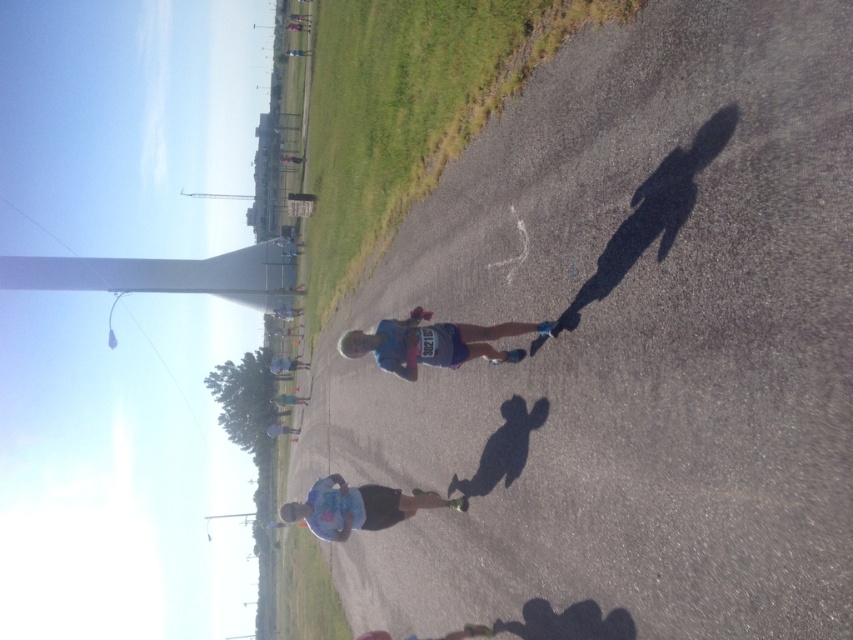
You are a photographer standing at the starting line of the race. You want to take a photo that includes both the point where the first runner is currently standing at point (x=445, y=324) and the point where the second runner is ahead at point (x=320, y=497). Which runner is closer to the camera so you can focus on them first?

Point (x=445, y=324) is closer to the viewer than point (x=320, y=497), so the first runner at point (x=445, y=324) is closer to the camera and should be focused on first.

You are a photographer standing at the starting line of a race and see the blue fabric skateboard at center. Where should you position your camera to capture the skateboard in the frame?

The blue fabric skateboard at center is located at point (434,342), so you should position your camera at the starting line and aim towards the center of the image to capture the skateboard.